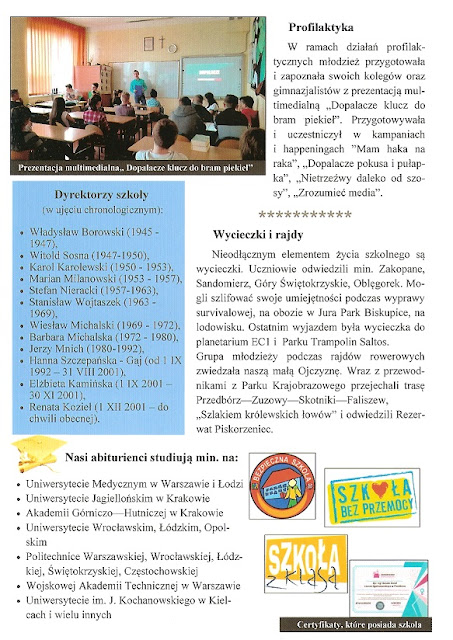
The height and width of the screenshot is (640, 453). Find the location of `diploma white and blue`. diploma white and blue is located at coordinates pyautogui.click(x=399, y=591).